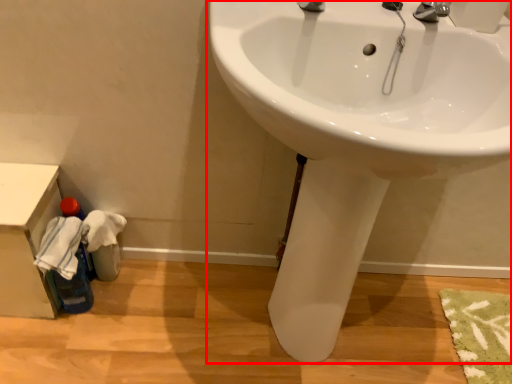
Question: From the image's perspective, what is the correct spatial positioning of sink (annotated by the red box) in reference to counter top?

Choices:
 (A) below
 (B) above

Answer: (B)